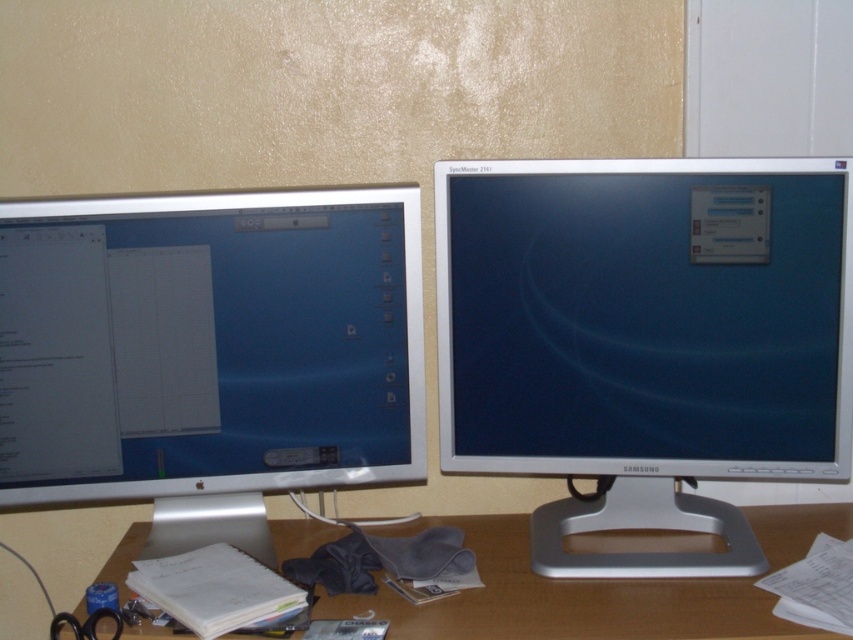
Question: Does silver metallic monitor at right appear over wooden desk at lower center?

Choices:
 (A) no
 (B) yes

Answer: (B)

Question: Which point is farther to the camera?

Choices:
 (A) (469, 324)
 (B) (351, 365)

Answer: (B)

Question: Which point is closer to the camera?

Choices:
 (A) silver metallic monitor at left
 (B) silver metallic monitor at right

Answer: (A)

Question: Does silver metallic monitor at right have a greater width compared to silver metallic monitor at left?

Choices:
 (A) yes
 (B) no

Answer: (B)

Question: Is silver metallic monitor at right wider than silver metallic monitor at left?

Choices:
 (A) no
 (B) yes

Answer: (A)

Question: Which of the following is the closest to the observer?

Choices:
 (A) silver metallic monitor at left
 (B) silver metallic monitor at right

Answer: (A)